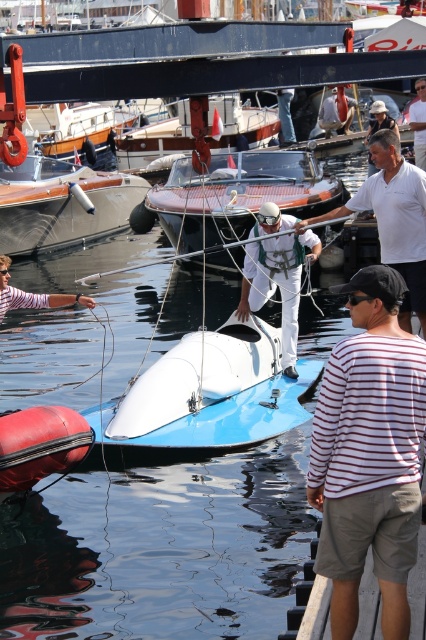
You are a photographer trying to capture a clear photo of the white fabric man at center and the white fabric helmet at center. However, you notice that one of the objects is blocking the view of the other. Which object is blocking the view of the other?

The white fabric helmet at center is blocking the view of the white fabric man at center because it is positioned in front of him.

You are a photographer trying to capture the man on the boat holding the rope. The coordinates you have for the white fabric helmet are point [278,284]. Based on the scene description, where is this point located?

The point [278,284] corresponds to the white fabric helmet at center, which is worn by the man on the boat holding the rope.

You are standing on the jetty and want to throw a lifebuoy to someone near the boat. The coordinates of your position are point (109,225) and the target is at point (175,150). Which direction should you aim to reach the target?

You should aim behind your current position because point (109,225) is in front of point (175,150), so the target is behind you.